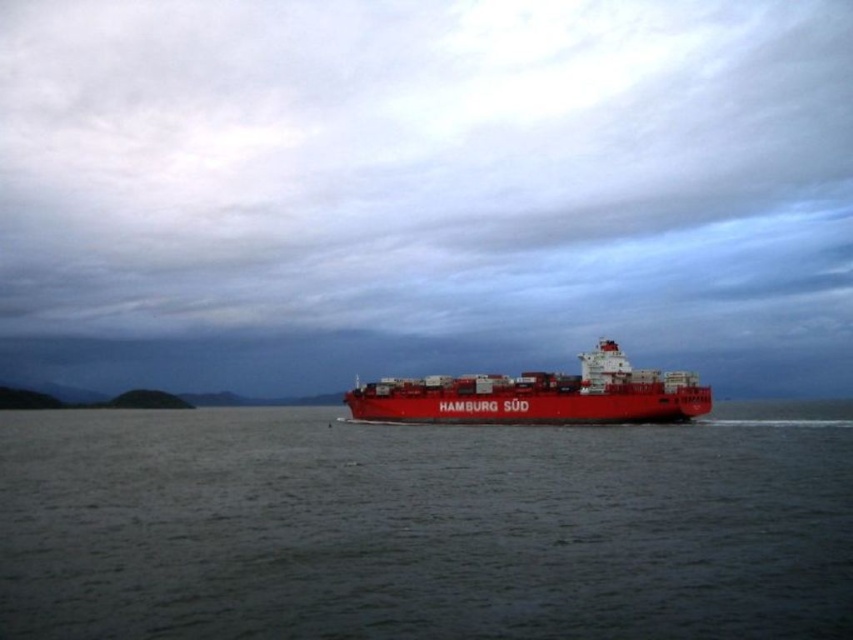
Question: Which of the following is the farthest from the observer?

Choices:
 (A) (370, 390)
 (B) (233, 556)

Answer: (A)

Question: Is dark gray water at center above matte red container ship at center?

Choices:
 (A) no
 (B) yes

Answer: (A)

Question: Among these objects, which one is nearest to the camera?

Choices:
 (A) dark gray water at center
 (B) matte red container ship at center

Answer: (A)

Question: Is the position of dark gray water at center more distant than that of matte red container ship at center?

Choices:
 (A) no
 (B) yes

Answer: (A)

Question: Which point is farther to the camera?

Choices:
 (A) dark gray water at center
 (B) matte red container ship at center

Answer: (B)

Question: Is dark gray water at center bigger than matte red container ship at center?

Choices:
 (A) no
 (B) yes

Answer: (A)